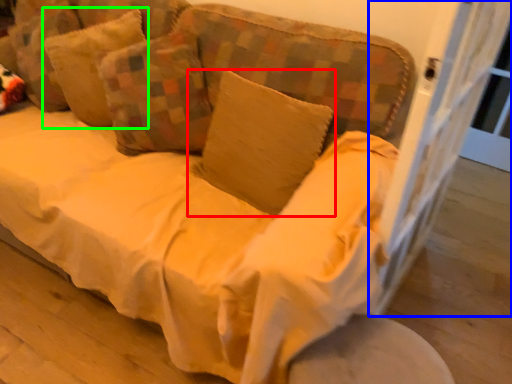
Question: Based on their relative distances, which object is nearer to pillow (highlighted by a red box)? Choose from screen door (highlighted by a blue box) and pillow (highlighted by a green box).

Choices:
 (A) screen door
 (B) pillow

Answer: (A)